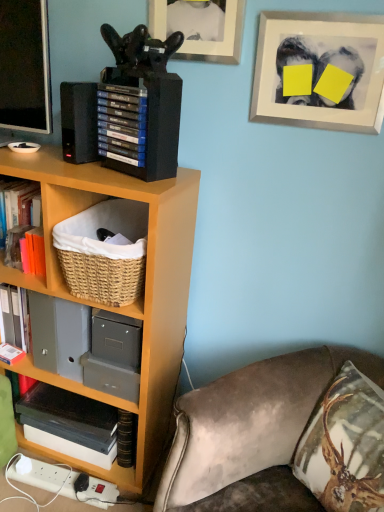
Question: Considering the relative sizes of woven natural basket at lower left and blue matte game cases at upper left in the image provided, is woven natural basket at lower left thinner than blue matte game cases at upper left?

Choices:
 (A) yes
 (B) no

Answer: (B)

Question: Can you confirm if woven natural basket at lower left is wider than blue matte game cases at upper left?

Choices:
 (A) yes
 (B) no

Answer: (A)

Question: Is woven natural basket at lower left oriented towards blue matte game cases at upper left?

Choices:
 (A) yes
 (B) no

Answer: (B)

Question: Is woven natural basket at lower left to the right of blue matte game cases at upper left from the viewer's perspective?

Choices:
 (A) no
 (B) yes

Answer: (A)

Question: Is woven natural basket at lower left oriented away from blue matte game cases at upper left?

Choices:
 (A) yes
 (B) no

Answer: (B)

Question: Considering the positions of wooden bookcase at left and blue matte game cases at upper left in the image, is wooden bookcase at left taller or shorter than blue matte game cases at upper left?

Choices:
 (A) short
 (B) tall

Answer: (B)

Question: Considering the positions of wooden bookcase at left and blue matte game cases at upper left in the image, is wooden bookcase at left bigger or smaller than blue matte game cases at upper left?

Choices:
 (A) small
 (B) big

Answer: (B)

Question: Is wooden bookcase at left wider or thinner than blue matte game cases at upper left?

Choices:
 (A) thin
 (B) wide

Answer: (B)

Question: Is wooden bookcase at left inside or outside of blue matte game cases at upper left?

Choices:
 (A) inside
 (B) outside

Answer: (B)

Question: From the image's perspective, is black plastic speaker at upper left above or below white plastic plug at lower left?

Choices:
 (A) above
 (B) below

Answer: (A)

Question: Would you say black plastic speaker at upper left is inside or outside white plastic plug at lower left?

Choices:
 (A) outside
 (B) inside

Answer: (A)

Question: Considering the positions of black plastic speaker at upper left and white plastic plug at lower left in the image, is black plastic speaker at upper left wider or thinner than white plastic plug at lower left?

Choices:
 (A) thin
 (B) wide

Answer: (B)

Question: Is black plastic speaker at upper left in front of or behind white plastic plug at lower left in the image?

Choices:
 (A) front
 (B) behind

Answer: (A)

Question: Looking at their shapes, would you say white matte picture frame at upper right, which is counted as the 2th picture frame, starting from the left, is wider or thinner than black glossy speaker at upper left?

Choices:
 (A) wide
 (B) thin

Answer: (B)

Question: Is white matte picture frame at upper right, which is counted as the 2th picture frame, starting from the left, taller or shorter than black glossy speaker at upper left?

Choices:
 (A) short
 (B) tall

Answer: (A)